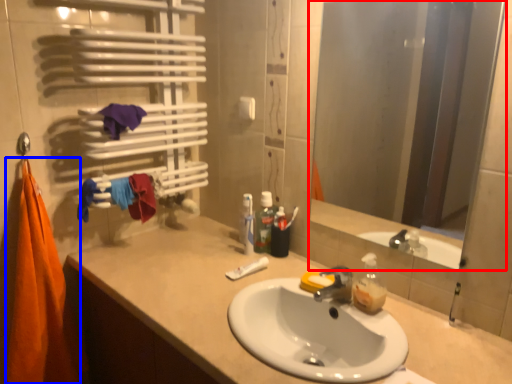
Question: Which object appears closest to the camera in this image, mirror (highlighted by a red box) or beach towel (highlighted by a blue box)?

Choices:
 (A) mirror
 (B) beach towel

Answer: (A)